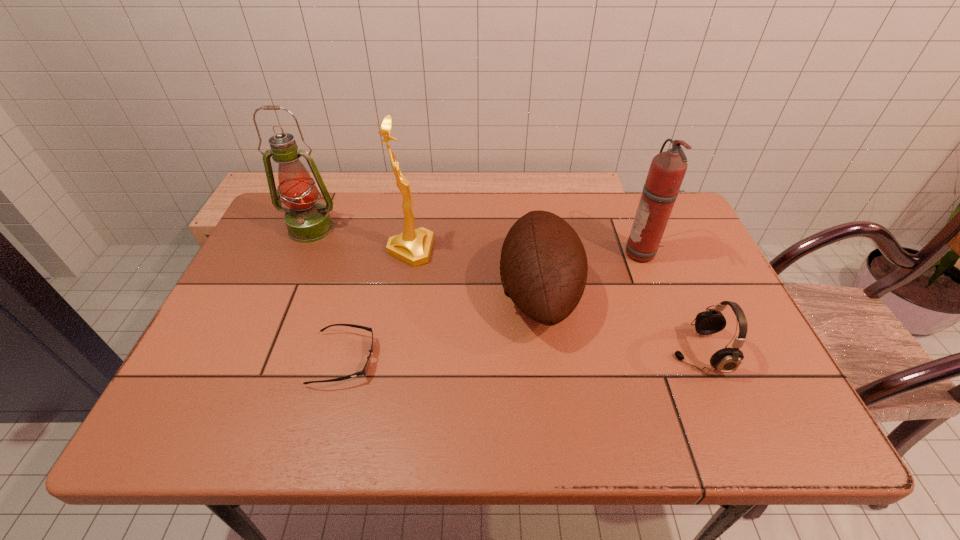
Find the location of a particular element. This screenshot has height=540, width=960. vacant space positioned on the side of the fire extinguisher with the label and nozzle is located at coordinates tap(499, 254).

Find the location of a particular element. The image size is (960, 540). blank area located 0.280m on the side of the fire extinguisher with the label and nozzle is located at coordinates (524, 254).

Where is `vacant space located 0.340m on the laces of the football`? The height and width of the screenshot is (540, 960). vacant space located 0.340m on the laces of the football is located at coordinates (366, 293).

Where is `vacant space located on the laces of the football`? Image resolution: width=960 pixels, height=540 pixels. vacant space located on the laces of the football is located at coordinates (456, 293).

Identify the location of free space located 0.320m on the laces of the football. (373, 293).

This screenshot has width=960, height=540. What are the coordinates of `free space located 0.360m with the microphone on the side of the headset` in the screenshot? It's located at (513, 353).

You are a GUI agent. You are given a task and a screenshot of the screen. Output one action in this format:
    pyautogui.click(x=<x>, y=<y>)
    Task: Click on the free region located 0.330m with the microphone on the side of the headset
    
    Given the screenshot: What is the action you would take?
    pyautogui.click(x=526, y=353)

Locate an element on the screen. vacant space located 0.380m with the microphone on the side of the headset is located at coordinates (504, 353).

This screenshot has width=960, height=540. In order to click on vacant space located on the front-facing side of the sunglasses in this screenshot , I will do `click(411, 359)`.

Identify the location of award that is at the far edge. pos(413,246).